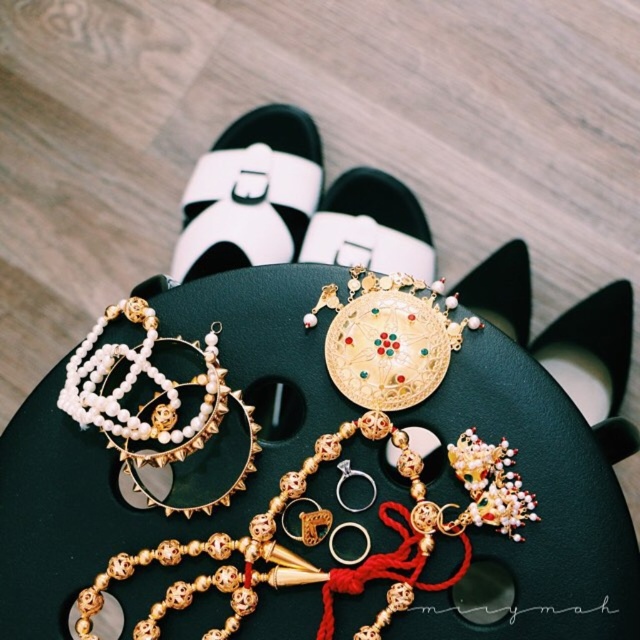
Can you confirm if white leather sandal at upper center is positioned above gold metallic earring at center?

Yes.

Does white leather sandal at upper center have a greater height compared to gold metallic earring at center?

Yes, white leather sandal at upper center is taller than gold metallic earring at center.

Locate an element on the screen. Image resolution: width=640 pixels, height=640 pixels. white leather sandal at upper center is located at coordinates (250, 193).

What are the coordinates of `white leather sandal at upper center` in the screenshot? It's located at (250, 193).

Does white leather sandal at upper center have a larger size compared to black matte shoe at center?

Indeed, white leather sandal at upper center has a larger size compared to black matte shoe at center.

Is white leather sandal at upper center above black matte shoe at center?

Yes.

Locate an element on the screen. The width and height of the screenshot is (640, 640). white leather sandal at upper center is located at coordinates (250, 193).

Does pearl/golden beaded necklace at upper left have a greater width compared to black matte shoe at center?

Correct, the width of pearl/golden beaded necklace at upper left exceeds that of black matte shoe at center.

Does pearl/golden beaded necklace at upper left have a lesser width compared to black matte shoe at center?

No, pearl/golden beaded necklace at upper left is not thinner than black matte shoe at center.

Where is `pearl/golden beaded necklace at upper left`? This screenshot has height=640, width=640. pearl/golden beaded necklace at upper left is located at coordinates (156, 412).